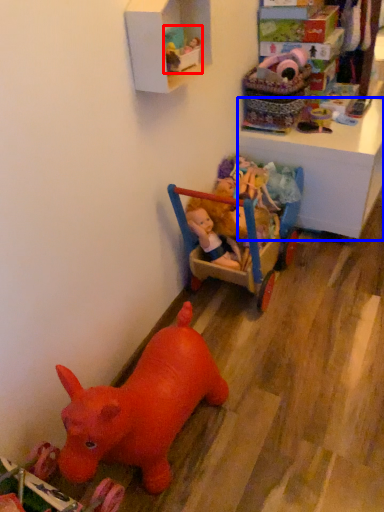
Question: Which point is closer to the camera, toy (highlighted by a red box) or changing table (highlighted by a blue box)?

Choices:
 (A) toy
 (B) changing table

Answer: (A)